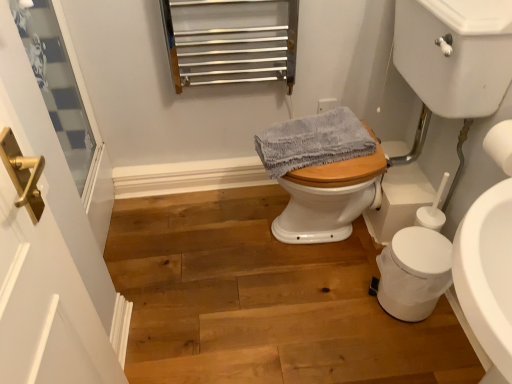
Question: Considering the relative sizes of white matte trash can at lower right and wooden floor at center in the image provided, is white matte trash can at lower right thinner than wooden floor at center?

Choices:
 (A) yes
 (B) no

Answer: (A)

Question: Can you confirm if white matte trash can at lower right is positioned to the right of wooden floor at center?

Choices:
 (A) yes
 (B) no

Answer: (A)

Question: Does white matte trash can at lower right have a greater height compared to wooden floor at center?

Choices:
 (A) no
 (B) yes

Answer: (B)

Question: From the image's perspective, is white matte trash can at lower right located beneath wooden floor at center?

Choices:
 (A) yes
 (B) no

Answer: (B)

Question: Considering the relative sizes of white matte trash can at lower right and wooden floor at center in the image provided, is white matte trash can at lower right shorter than wooden floor at center?

Choices:
 (A) yes
 (B) no

Answer: (B)

Question: Is white matte trash can at lower right to the left of wooden floor at center from the viewer's perspective?

Choices:
 (A) yes
 (B) no

Answer: (B)

Question: Can you confirm if white glossy sink at center right is shorter than white matte trash can at lower right?

Choices:
 (A) yes
 (B) no

Answer: (B)

Question: Can you confirm if white glossy sink at center right is smaller than white matte trash can at lower right?

Choices:
 (A) yes
 (B) no

Answer: (B)

Question: From a real-world perspective, is white glossy sink at center right positioned over white matte trash can at lower right based on gravity?

Choices:
 (A) yes
 (B) no

Answer: (A)

Question: Is white glossy sink at center right at the left side of white matte trash can at lower right?

Choices:
 (A) yes
 (B) no

Answer: (A)

Question: Does white glossy sink at center right have a larger size compared to white matte trash can at lower right?

Choices:
 (A) yes
 (B) no

Answer: (A)

Question: Is white matte trash can at lower right surrounded by white glossy sink at center right?

Choices:
 (A) no
 (B) yes

Answer: (A)

Question: Considering the relative sizes of white matte toilet paper at right and gray textured towel at center in the image provided, is white matte toilet paper at right smaller than gray textured towel at center?

Choices:
 (A) yes
 (B) no

Answer: (A)